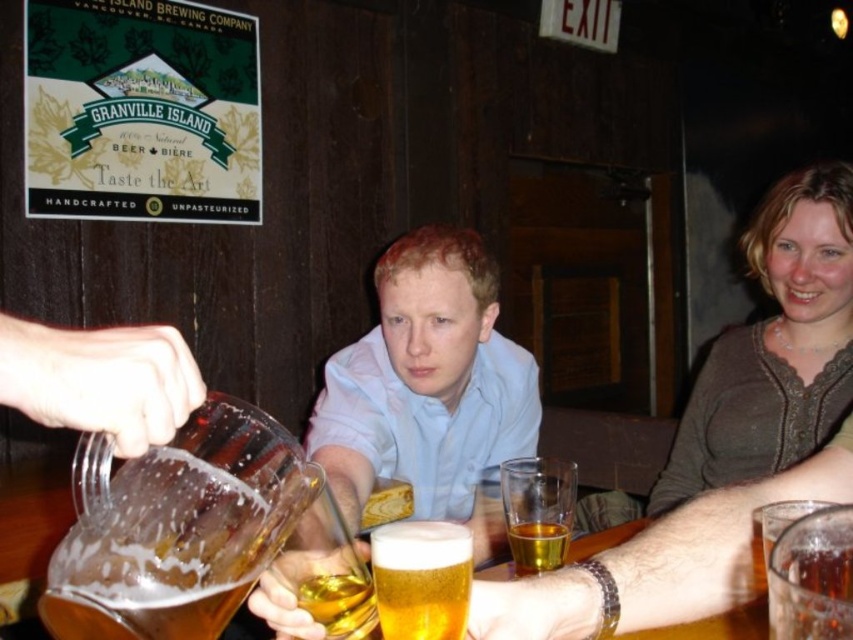
Is point (846, 362) positioned in front of point (434, 328)?

No.

Between translucent glass mug at center and matte glass mug at center, which one is positioned lower?

matte glass mug at center is below.

Identify the location of translucent glass mug at center. (723, 442).

Is matte brown sweater at upper right to the right of amber glass at center from the viewer's perspective?

Yes, matte brown sweater at upper right is to the right of amber glass at center.

Find the location of a particular element. The width and height of the screenshot is (853, 640). matte brown sweater at upper right is located at coordinates (775, 346).

At what (x,y) coordinates should I click in order to perform the action: click on matte brown sweater at upper right. Please return your answer as a coordinate pair (x, y). Looking at the image, I should click on (775, 346).

Between point (368, 627) and point (537, 556), which one is positioned behind?

Positioned behind is point (537, 556).

Between point (302, 596) and point (546, 532), which one is positioned in front?

Positioned in front is point (302, 596).

Is point (296, 589) positioned after point (564, 524)?

No, it is not.

Identify the location of golden liquid beer at center. This screenshot has height=640, width=853. click(339, 604).